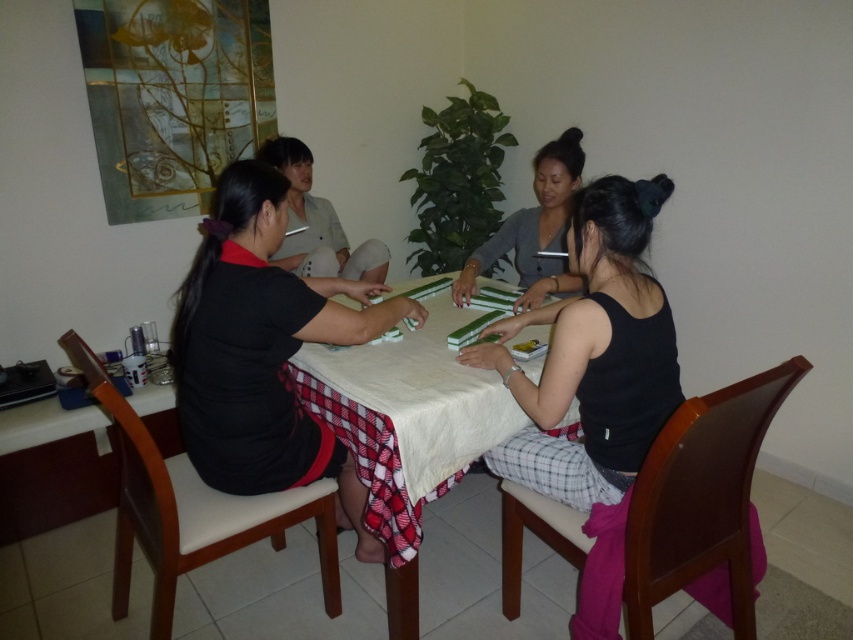
Does black matte tank top at lower right appear under white cloth-covered table at center?

No, black matte tank top at lower right is not below white cloth-covered table at center.

The height and width of the screenshot is (640, 853). Identify the location of black matte tank top at lower right. (595, 355).

Does black matte shirt at center appear on the right side of white cloth-covered table at center?

Incorrect, black matte shirt at center is not on the right side of white cloth-covered table at center.

Does black matte shirt at center appear over white cloth-covered table at center?

Incorrect, black matte shirt at center is not positioned above white cloth-covered table at center.

Which is in front, point (263, 179) or point (451, 460)?

Positioned in front is point (263, 179).

Identify the location of black matte shirt at center. (264, 352).

Who is more forward, (357, 548) or (505, 384)?

Positioned in front is point (505, 384).

Consider the image. Is black matte shirt at center wider than black matte tank top at lower right?

Correct, the width of black matte shirt at center exceeds that of black matte tank top at lower right.

This screenshot has height=640, width=853. Identify the location of black matte shirt at center. (264, 352).

Identify the location of black matte shirt at center. (264, 352).